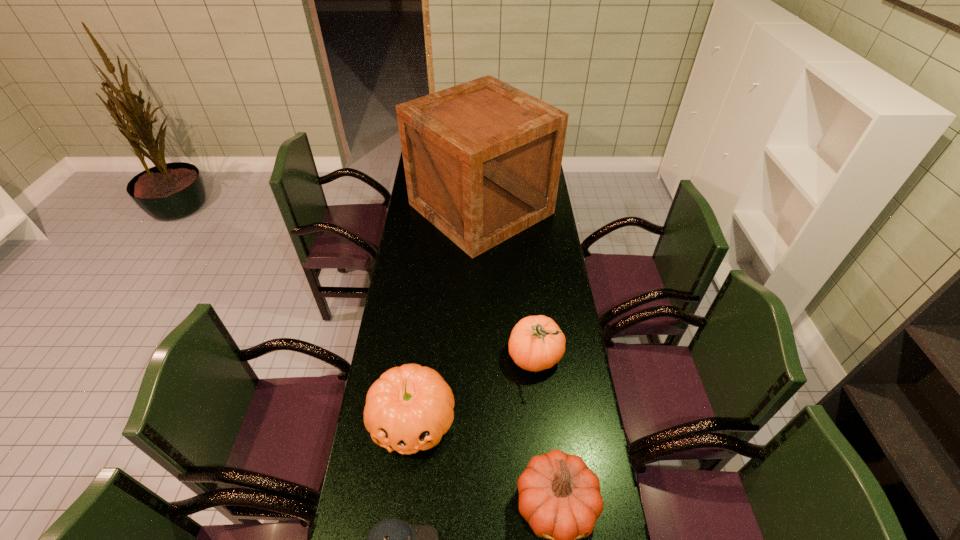
Identify the location of box that is at the right edge. This screenshot has height=540, width=960. (482, 159).

You are a GUI agent. You are given a task and a screenshot of the screen. Output one action in this format:
    pyautogui.click(x=<x>, y=<y>)
    Task: Click on the pumpkin located in the right edge section of the desktop
    This screenshot has width=960, height=540.
    Given the screenshot: What is the action you would take?
    pyautogui.click(x=536, y=343)

What are the coordinates of `object positioned at the far left corner` in the screenshot? It's located at (482, 159).

You are a GUI agent. You are given a task and a screenshot of the screen. Output one action in this format:
    pyautogui.click(x=<x>, y=<y>)
    Task: Click on the object that is at the far right corner
    Image resolution: width=960 pixels, height=540 pixels.
    Given the screenshot: What is the action you would take?
    pyautogui.click(x=482, y=159)

Where is `free region at the left edge of the desktop`? free region at the left edge of the desktop is located at coordinates (406, 322).

The height and width of the screenshot is (540, 960). In the image, there is a desktop. What are the coordinates of `vacant space at the right edge` in the screenshot? It's located at click(577, 397).

At what (x,y) coordinates should I click in order to perform the action: click on vacant space that's between the fourth shortest object and the leftmost pumpkin. Please return your answer as a coordinate pair (x, y). This screenshot has height=540, width=960. Looking at the image, I should click on (473, 388).

What are the coordinates of `object identified as the closest to the nearest pumpkin` in the screenshot? It's located at (409, 408).

I want to click on the third closest object relative to the tallest object, so (559, 496).

Where is `the closest pumpkin to the tallest pumpkin`? The image size is (960, 540). the closest pumpkin to the tallest pumpkin is located at coordinates (409, 408).